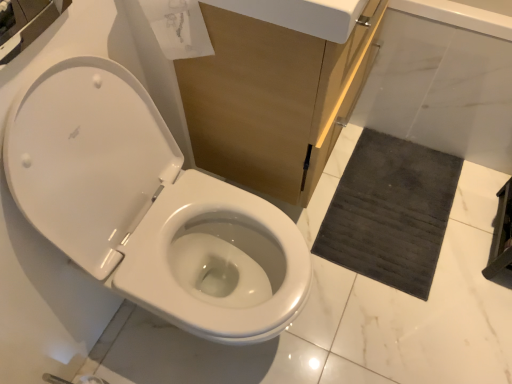
Where is `vacant area to the right of white glossy toilet at left`? vacant area to the right of white glossy toilet at left is located at coordinates (356, 295).